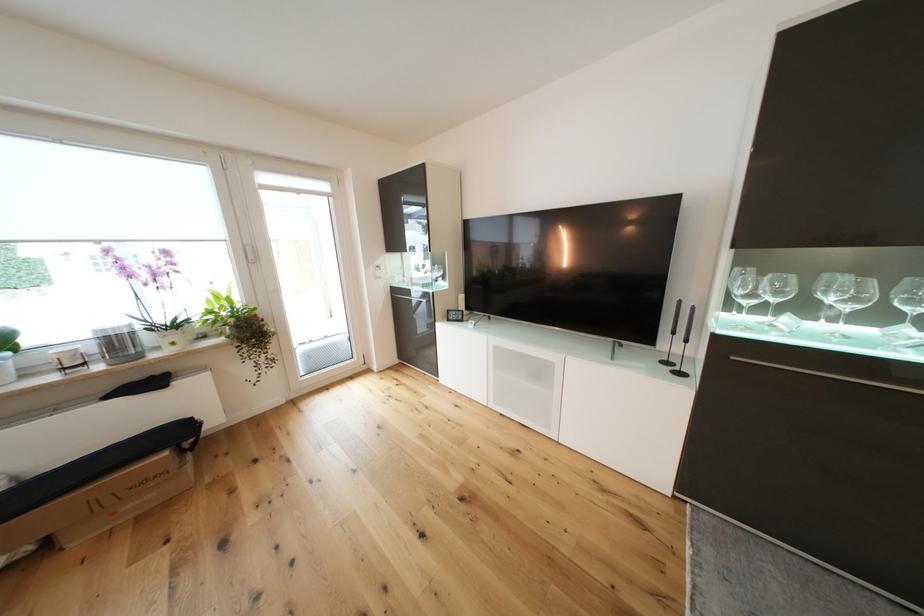
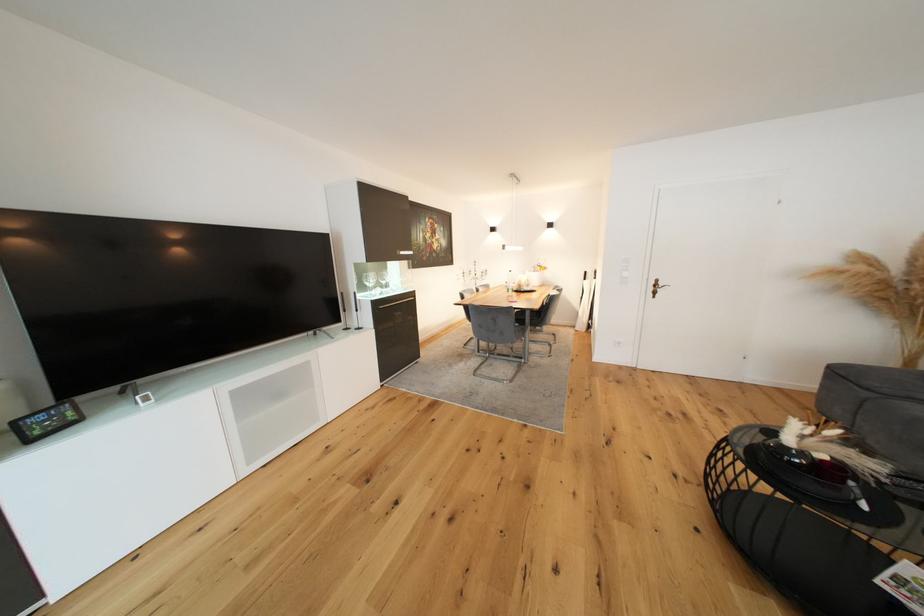
The point at (457, 320) is marked in the first image. Where is the corresponding point in the second image?

(44, 434)